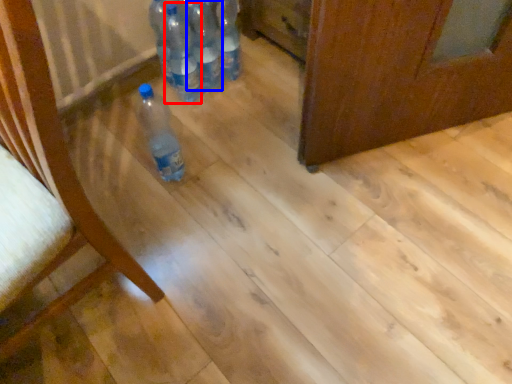
Question: Which of the following is the farthest to the observer, bottle (highlighted by a red box) or bottle (highlighted by a blue box)?

Choices:
 (A) bottle
 (B) bottle

Answer: (B)